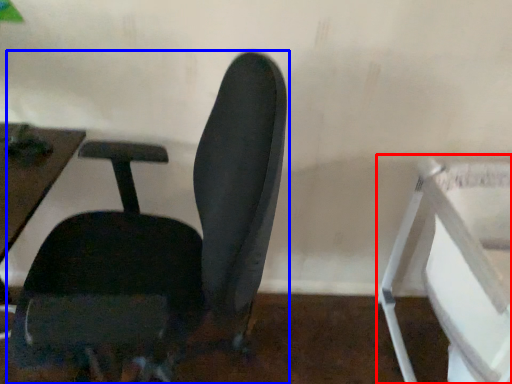
Question: Which object appears closest to the camera in this image, feeding chair (highlighted by a red box) or chair (highlighted by a blue box)?

Choices:
 (A) feeding chair
 (B) chair

Answer: (B)